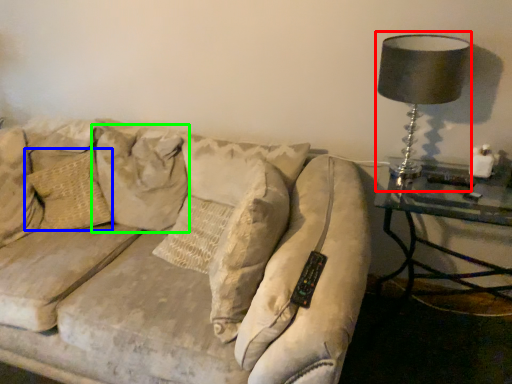
Question: Estimate the real-world distances between objects in this image. Which object is farther from table lamp (highlighted by a red box), pillow (highlighted by a blue box) or pillow (highlighted by a green box)?

Choices:
 (A) pillow
 (B) pillow

Answer: (A)